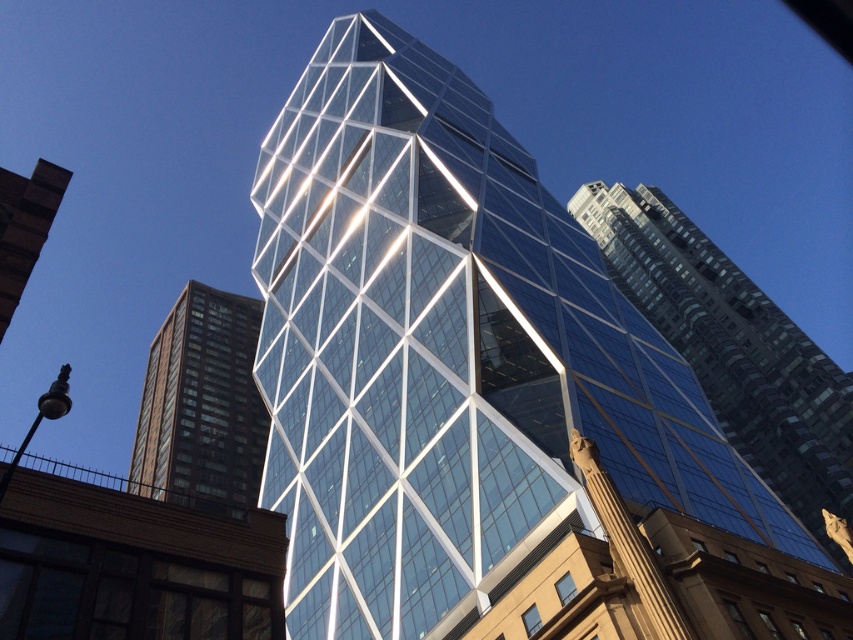
Looking at this image, you are an architect analyzing the layout of the city. Given that the transparent glass skyscraper at center is positioned at coordinates 0.545 on the x and 0.859 on the y, can you determine its central location in the image?

The transparent glass skyscraper at center is located at point (732, 348), so its central coordinates are x 0.545 and y 0.859.

You are an architect analyzing the layout of the city skyline. You notice two glass skyscrapers in the scene. Which one is positioned higher in the image, the transparent glass skyscraper at center or the clear glass skyscraper at upper center?

The transparent glass skyscraper at center is located above the clear glass skyscraper at upper center, so it is positioned higher in the image.